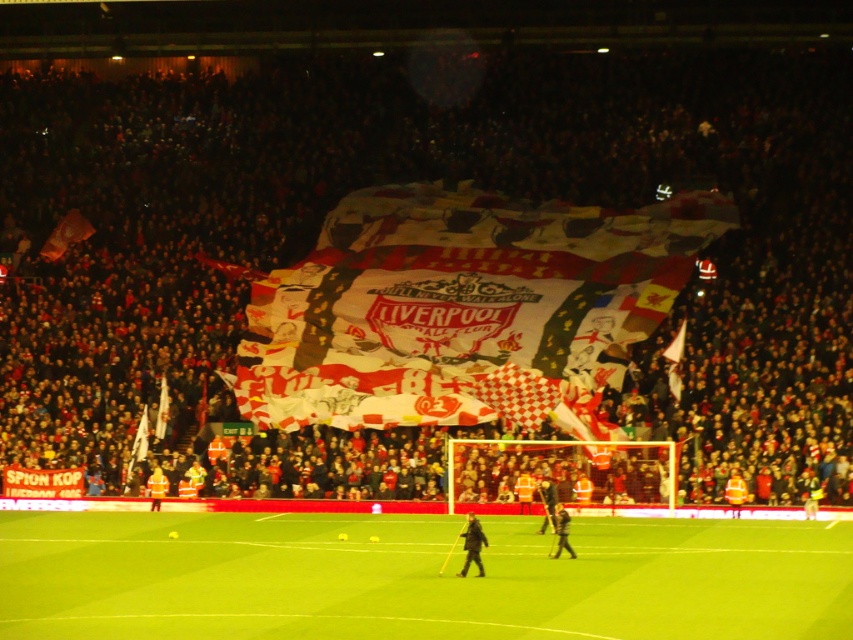
Question: Considering the real-world distances, which object is closest to the dark fabric jacket at center?

Choices:
 (A) dark gray fabric at center
 (B) green artificial turf at center

Answer: (B)

Question: Is dark gray uniform at center above reflective silver jacket at center?

Choices:
 (A) yes
 (B) no

Answer: (A)

Question: Estimate the real-world distances between objects in this image. Which object is farther from the green artificial turf at center?

Choices:
 (A) white fabric crowd at center
 (B) dark gray uniform at center
 (C) dark gray fabric at center

Answer: (A)

Question: Does white fabric crowd at center appear on the left side of dark gray fabric at center?

Choices:
 (A) yes
 (B) no

Answer: (A)

Question: Is white fabric crowd at center further to camera compared to dark fabric jacket at center?

Choices:
 (A) no
 (B) yes

Answer: (B)

Question: Which point is farther from the camera taking this photo?

Choices:
 (A) (204, 196)
 (B) (544, 493)
 (C) (560, 522)

Answer: (A)